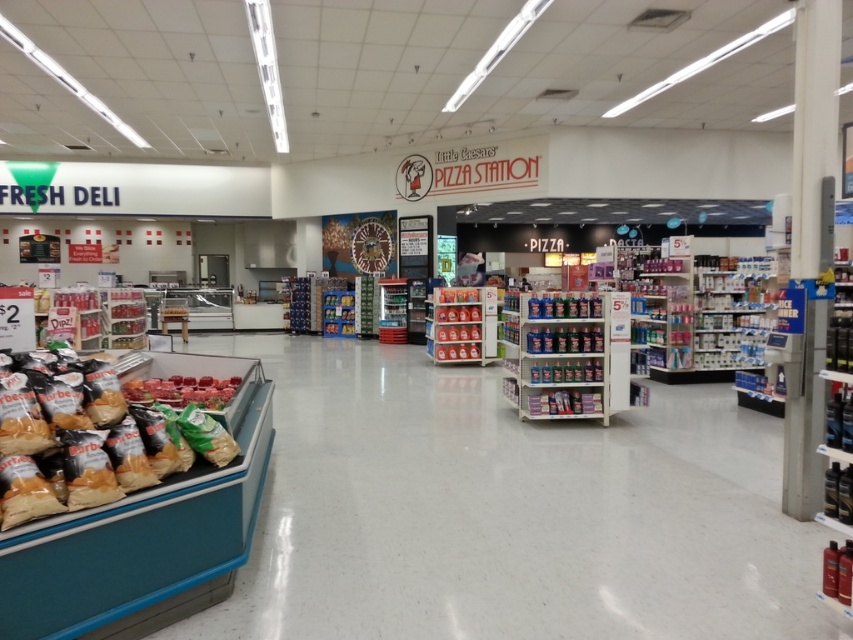
Consider the image. You are a customer in the store and want to reach the Little Caesars Pizza Station. You are currently standing at point [486,289]. There is another customer at point [132,380]. Which direction should you move to avoid bumping into them while heading towards the Pizza Station?

Since point [486,289] is behind point [132,380], you should move around the customer at point [132,380] either to their left or right to reach the Little Caesars Pizza Station without collision.